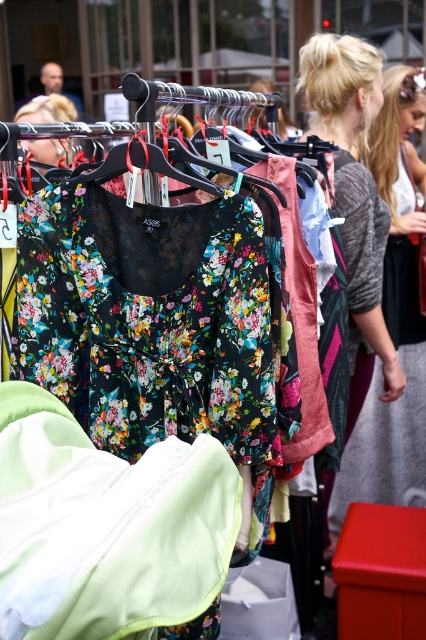
You are a customer trying to decide which item to pick first. You see two points marked on the rack. Which point is closer to you, point (89, 577) or point (383, 426)?

Point (89, 577) is closer to the viewer than point (383, 426).

You are a customer at the outdoor market looking at the clothing display. You see the light green fabric at lower left and the gray knit sweater at center. Which one is closer to you?

The light green fabric at lower left is closer to you because it is in front of the gray knit sweater at center.

In the scene shown: You are a customer at the outdoor market looking at the clothing display. You see the light green fabric at lower left. Can you tell me its exact location in terms of coordinates?

The light green fabric at lower left is located at coordinates point [106,525].